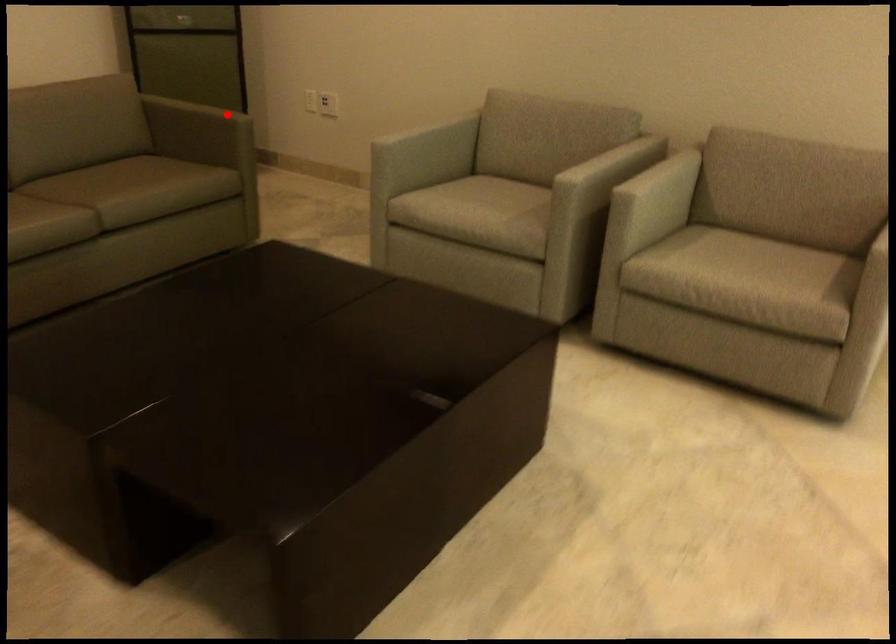
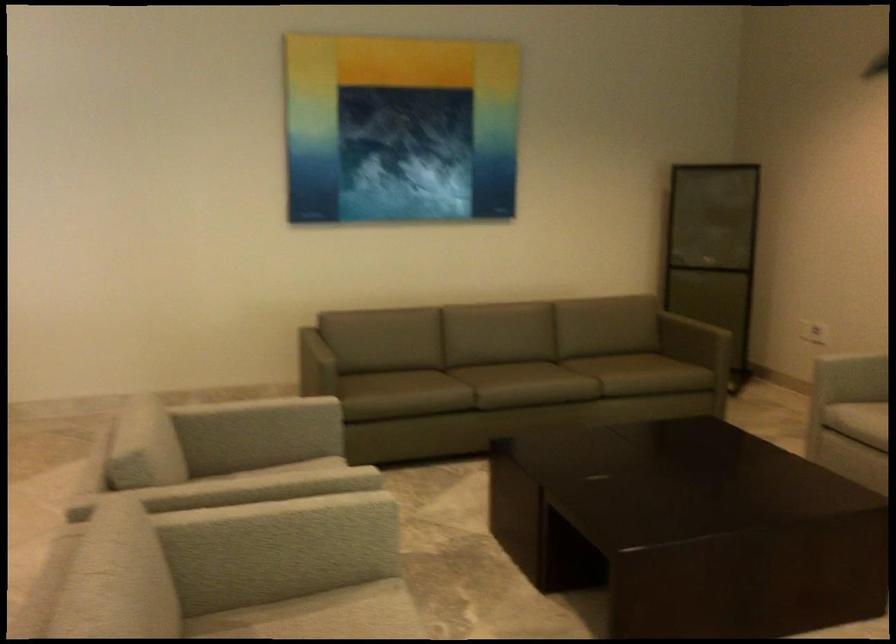
Question: I am providing you with two images of the same scene from different viewpoints. Image1 has a red point marked. In image2, the corresponding 3D location appears at what relative position? Reply with the corresponding letter.

Choices:
 (A) Closer
 (B) Farther

Answer: (B)